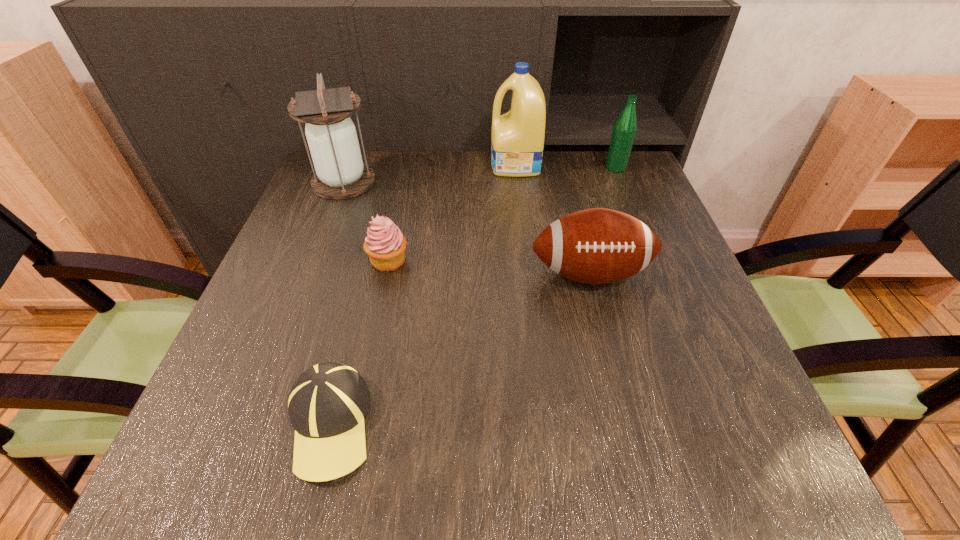
The width and height of the screenshot is (960, 540). In order to click on object identified as the closest to the bottle in this screenshot , I will do `click(517, 142)`.

Locate an element on the screen. This screenshot has width=960, height=540. free location that satisfies the following two spatial constraints: 1. on the label of the detergent; 2. with the brim of the baseball cap facing forward is located at coordinates (543, 423).